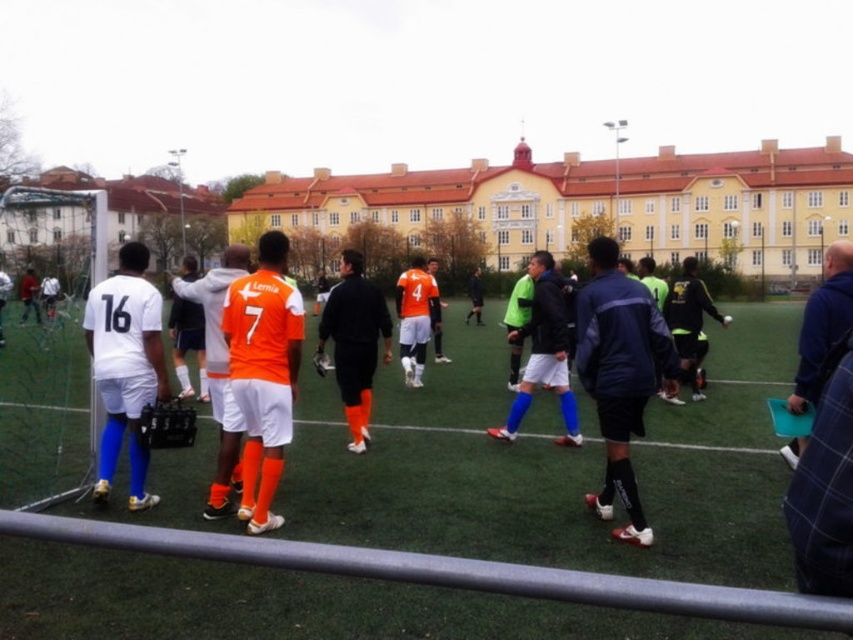
Question: Is orange socks at center further to camera compared to orange jersey at center?

Choices:
 (A) no
 (B) yes

Answer: (B)

Question: Estimate the real-world distances between objects in this image. Which object is farther from the matte white jersey at left?

Choices:
 (A) orange socks at center
 (B) dark blue textured jacket at center

Answer: (B)

Question: Considering the real-world distances, which object is farthest from the dark blue textured jacket at center?

Choices:
 (A) neon green jersey at center
 (B) white matte soccer jersey at left

Answer: (B)

Question: Which point appears farthest from the camera in this image?

Choices:
 (A) (830, 371)
 (B) (540, 346)
 (C) (445, 563)
 (D) (216, 310)

Answer: (B)

Question: Is orange jersey at center closer to the viewer compared to blue fabric jacket at right?

Choices:
 (A) no
 (B) yes

Answer: (A)

Question: Is metallic gray rail at lower center positioned behind orange socks at center?

Choices:
 (A) no
 (B) yes

Answer: (A)